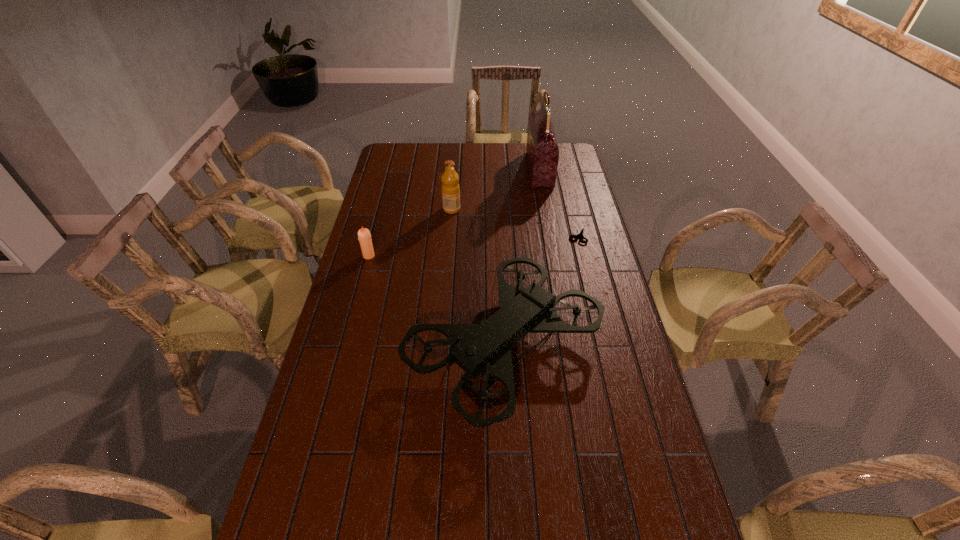
You are a GUI agent. You are given a task and a screenshot of the screen. Output one action in this format:
    pyautogui.click(x=<x>, y=<y>)
    Task: Click on the drone located in the right edge section of the desktop
    Image resolution: width=960 pixels, height=540 pixels.
    Given the screenshot: What is the action you would take?
    pyautogui.click(x=484, y=349)

This screenshot has width=960, height=540. I want to click on shears that is at the right edge, so click(580, 234).

Where is `object at the far right corner`? Image resolution: width=960 pixels, height=540 pixels. object at the far right corner is located at coordinates (x=542, y=151).

In the image, there is a desktop. Where is `vacant space at the far edge`? The image size is (960, 540). vacant space at the far edge is located at coordinates (456, 146).

Find the location of a particular element. free location at the left edge is located at coordinates coord(348,293).

At what (x,y) coordinates should I click in order to perform the action: click on vacant area at the right edge of the desktop. Please return your answer as a coordinate pair (x, y). This screenshot has height=540, width=960. Looking at the image, I should click on (623, 380).

Image resolution: width=960 pixels, height=540 pixels. In the image, there is a desktop. In order to click on vacant area at the far left corner in this screenshot , I will do `click(406, 164)`.

I want to click on blank space at the far right corner of the desktop, so [575, 153].

I want to click on vacant area that lies between the third shortest object and the second shortest object, so click(x=410, y=232).

In order to click on free point between the candle and the shears in this screenshot , I will do `click(473, 246)`.